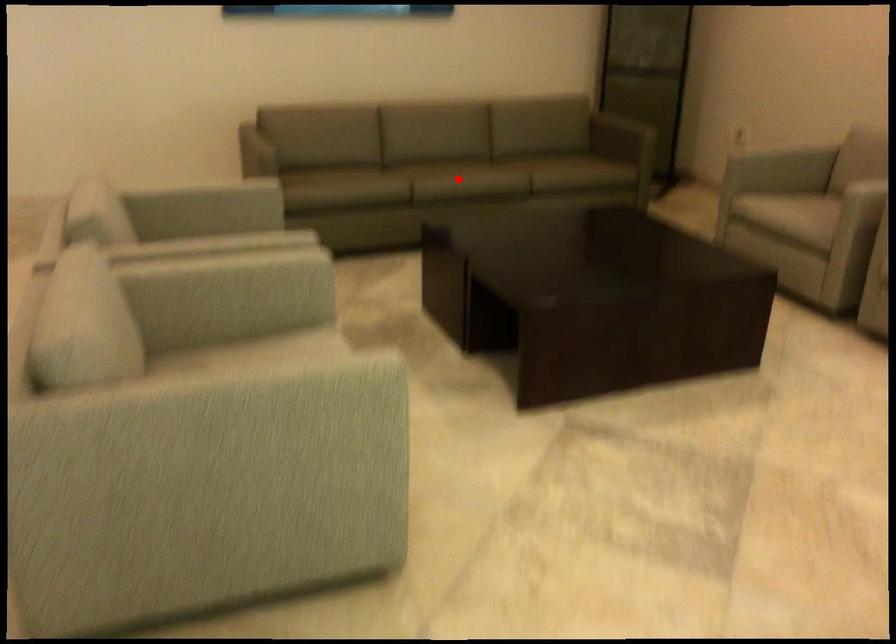
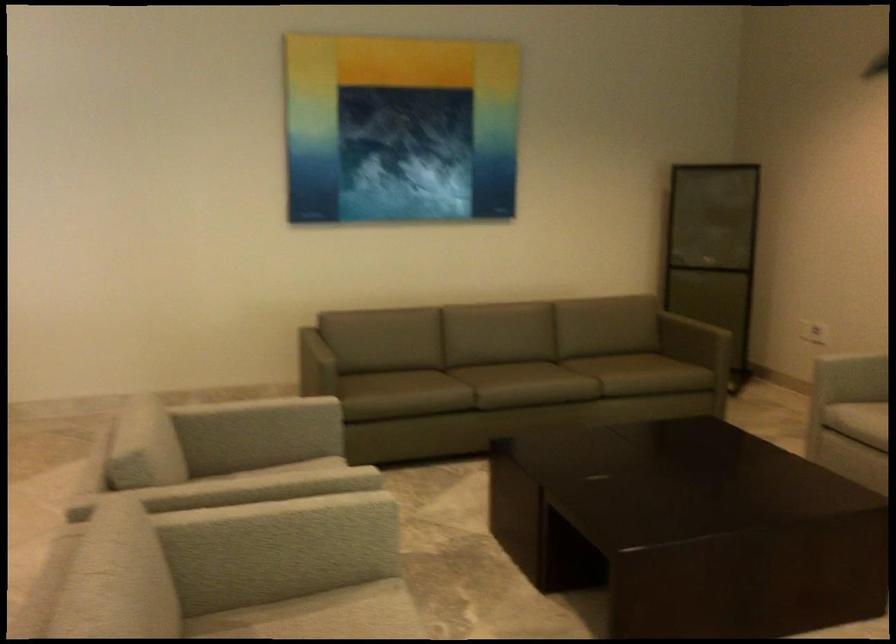
The point at the highlighted location is marked in the first image. Where is the corresponding point in the second image?

(524, 384)